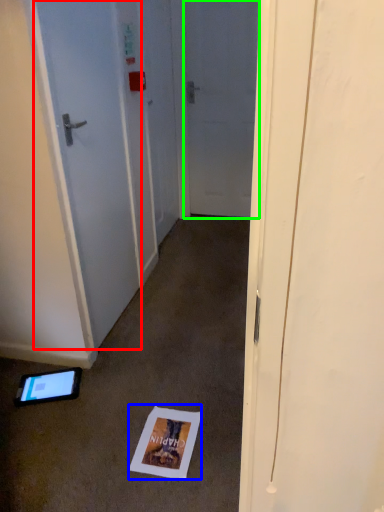
Question: Which object is positioned closest to door (highlighted by a red box)? Select from postcard (highlighted by a blue box) and door (highlighted by a green box).

Choices:
 (A) postcard
 (B) door

Answer: (A)